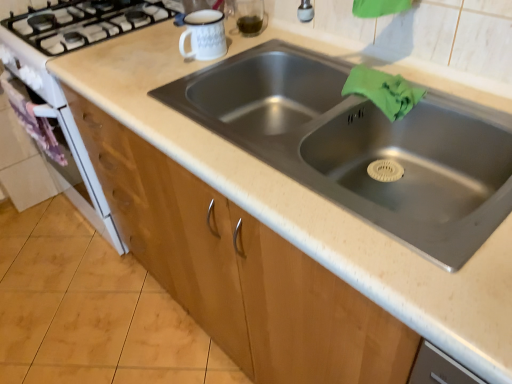
Question: Is stainless steel sink at center not inside wooden cabinet at lower center?

Choices:
 (A) yes
 (B) no

Answer: (A)

Question: Is stainless steel sink at center next to wooden cabinet at lower center and touching it?

Choices:
 (A) no
 (B) yes

Answer: (A)

Question: Is stainless steel sink at center behind wooden cabinet at lower center?

Choices:
 (A) yes
 (B) no

Answer: (B)

Question: From the image's perspective, is stainless steel sink at center below wooden cabinet at lower center?

Choices:
 (A) no
 (B) yes

Answer: (A)

Question: Is stainless steel sink at center taller than wooden cabinet at lower center?

Choices:
 (A) no
 (B) yes

Answer: (B)

Question: Is stainless steel sink at center positioned far away from wooden cabinet at lower center?

Choices:
 (A) no
 (B) yes

Answer: (A)

Question: Is stainless steel sink at center wider than green fabric at sink right?

Choices:
 (A) yes
 (B) no

Answer: (A)

Question: From a real-world perspective, is stainless steel sink at center beneath green fabric at sink right?

Choices:
 (A) no
 (B) yes

Answer: (B)

Question: Is there a large distance between stainless steel sink at center and green fabric at sink right?

Choices:
 (A) no
 (B) yes

Answer: (A)

Question: Can you confirm if stainless steel sink at center is thinner than green fabric at sink right?

Choices:
 (A) no
 (B) yes

Answer: (A)

Question: Is the surface of stainless steel sink at center in direct contact with green fabric at sink right?

Choices:
 (A) yes
 (B) no

Answer: (B)

Question: Could you tell me if stainless steel sink at center is facing green fabric at sink right?

Choices:
 (A) no
 (B) yes

Answer: (A)

Question: Is wooden cabinet at lower center wider than stainless steel sink at center?

Choices:
 (A) no
 (B) yes

Answer: (B)